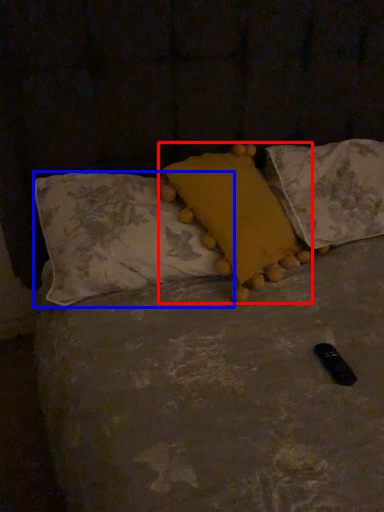
Question: Which object is closer to the camera taking this photo, pillow (highlighted by a red box) or pillow (highlighted by a blue box)?

Choices:
 (A) pillow
 (B) pillow

Answer: (B)